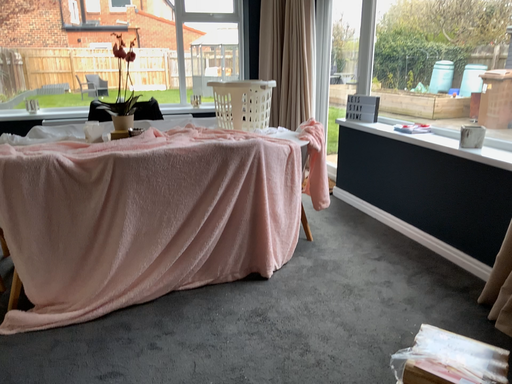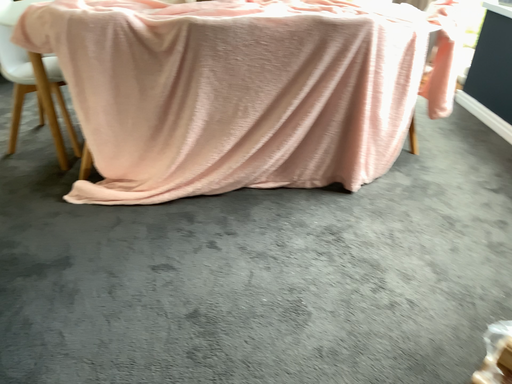
Question: Which way did the camera rotate in the video?

Choices:
 (A) rotated downward
 (B) rotated upward

Answer: (A)